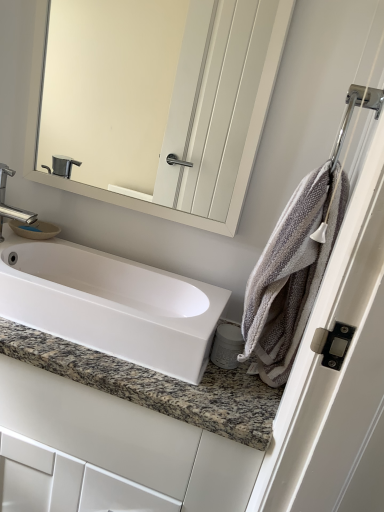
Question: In terms of size, does gray textured towel at right appear bigger or smaller than white glossy cabinet at center?

Choices:
 (A) big
 (B) small

Answer: (B)

Question: Considering the relative positions of gray textured towel at right and white glossy cabinet at center in the image provided, is gray textured towel at right to the left or to the right of white glossy cabinet at center?

Choices:
 (A) left
 (B) right

Answer: (B)

Question: Estimate the real-world distances between objects in this image. Which object is closer to the white glossy cabinet at center?

Choices:
 (A) gray textured towel at right
 (B) silver metallic faucet at left
 (C) matte white mirror at upper center
 (D) chrome metallic towel bar at upper right
 (E) white glossy sink at center

Answer: (E)

Question: Which is nearer to the silver metallic faucet at left?

Choices:
 (A) white glossy cabinet at center
 (B) chrome metallic towel bar at upper right
 (C) gray textured towel at right
 (D) white glossy sink at center
 (E) matte white mirror at upper center

Answer: (D)